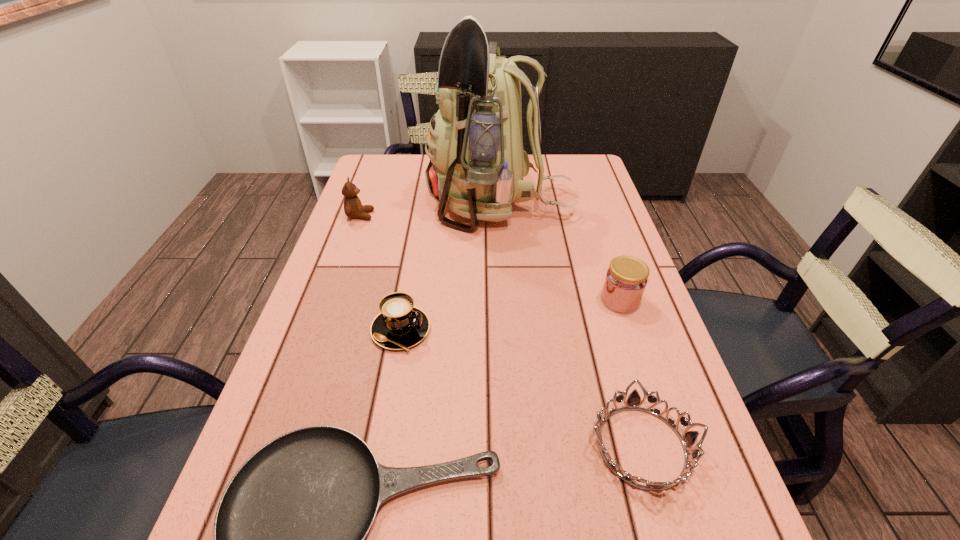
Identify the location of vacant area between the tallest object and the teddy bear. The image size is (960, 540). (430, 210).

Find the location of a particular element. free spot between the backpack and the second shortest object is located at coordinates (571, 326).

Locate an element on the screen. The image size is (960, 540). free space between the jam and the tiara is located at coordinates (631, 373).

At what (x,y) coordinates should I click in order to perform the action: click on free area in between the teddy bear and the tiara. Please return your answer as a coordinate pair (x, y). The image size is (960, 540). Looking at the image, I should click on (501, 331).

Locate an element on the screen. Image resolution: width=960 pixels, height=540 pixels. empty space that is in between the fifth tallest object and the fourth tallest object is located at coordinates (521, 388).

Where is `empty space that is in between the cappuccino and the teddy bear`? empty space that is in between the cappuccino and the teddy bear is located at coordinates (380, 273).

Locate which object is the fourth closest to the jam. Please provide its 2D coordinates. Your answer should be formatted as a tuple, i.e. [(x, y)], where the tuple contains the x and y coordinates of a point satisfying the conditions above.

[(400, 325)]

Identify which object is located as the fifth nearest to the tallest object. Please provide its 2D coordinates. Your answer should be formatted as a tuple, i.e. [(x, y)], where the tuple contains the x and y coordinates of a point satisfying the conditions above.

[(289, 530)]

Identify the location of free location that satisfies the following two spatial constraints: 1. at the face of the jam; 2. on the left side of the teddy bear. The image size is (960, 540). tap(330, 300).

Where is `vacant region that satisfies the following two spatial constraints: 1. at the face of the teddy bear; 2. on the back side of the jam`? vacant region that satisfies the following two spatial constraints: 1. at the face of the teddy bear; 2. on the back side of the jam is located at coordinates pyautogui.click(x=330, y=300).